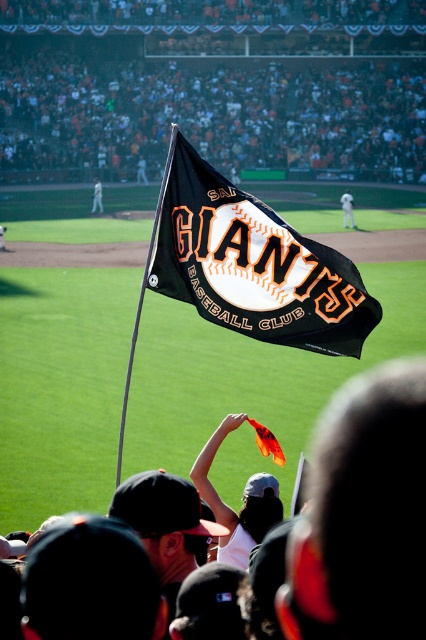
You are a photographer trying to capture a clear shot of the white uniform at center and the white fabric flag at upper center. Which object should you zoom in on to ensure it appears bigger in your photo?

The white uniform at center is larger in size than the white fabric flag at upper center, so you should zoom in on the white uniform at center to ensure it appears bigger in your photo.

You are a photographer standing at the edge of the baseball field. You want to take a photo of the white uniform at center without the black fabric crowd at upper center blocking the view. Is this possible?

The black fabric crowd at upper center is further to the viewer than the white uniform at center, so the photographer cannot take a photo of the white uniform at center without the black fabric crowd at upper center blocking the view because the crowd is closer to the photographer.

You are a photographer standing at the edge of the baseball field. You want to take a photo that includes both the black flag with orange and white lettering and the pitcher. However, you notice two points marked in the scene. Which point is closer to your camera position? The points are point (403, 177) and point (348, 214).

Point (348, 214) is closer to the camera position because it is less further than point (403, 177).